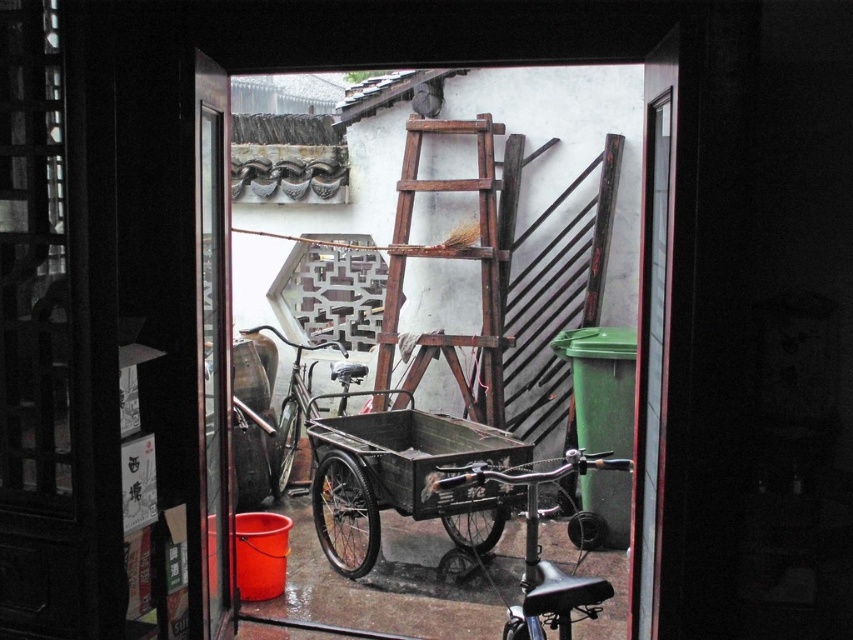
Consider the image. Based on the scene description, where is the wooden rustic ladder at center located in the image?

The wooden rustic ladder at center is located at point (448, 257) in the image.

You are standing in the doorway and want to exit the courtyard. You see the wooden rustic ladder at center and the shiny black bicycle at center. Which object is closer to you?

The wooden rustic ladder at center is closer to you because the shiny black bicycle at center is behind it.

Based on the photo, you are standing in the doorway and want to move the shiny black bicycle at center to the side to let a delivery cart pass through. Is the wooden rustic ladder at center blocking the path of the bicycle?

The wooden rustic ladder at center is located above the shiny black bicycle at center, so it is not blocking the path. You can move the bicycle freely.